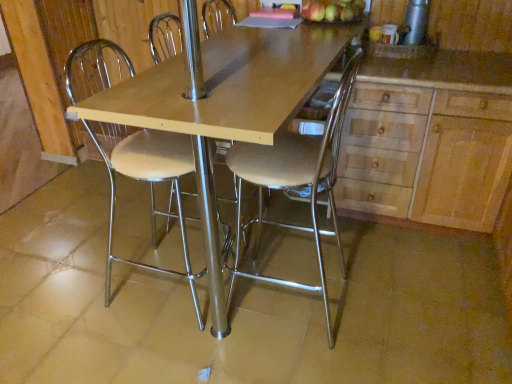
Question: From their relative heights in the image, would you say wooden cabinet at right is taller or shorter than silver metallic thermos at upper right?

Choices:
 (A) tall
 (B) short

Answer: (A)

Question: From a real-world perspective, is wooden cabinet at right physically located above or below silver metallic thermos at upper right?

Choices:
 (A) below
 (B) above

Answer: (A)

Question: Which is farther from the metallic silver chair at center, which is the 2th chair in left-to-right order?

Choices:
 (A) metallic silver stool at center, the first chair in the left-to-right sequence
 (B) wooden table at center
 (C) wooden cabinet at right
 (D) green matte apples at upper right
 (E) silver metallic thermos at upper right

Answer: (A)

Question: Which of these objects is positioned closest to the wooden cabinet at right?

Choices:
 (A) metallic silver chair at center, which is the 1th chair from right to left
 (B) metallic silver stool at center, which is the second chair in right-to-left order
 (C) silver metallic thermos at upper right
 (D) green matte apples at upper right
 (E) wooden table at center

Answer: (A)